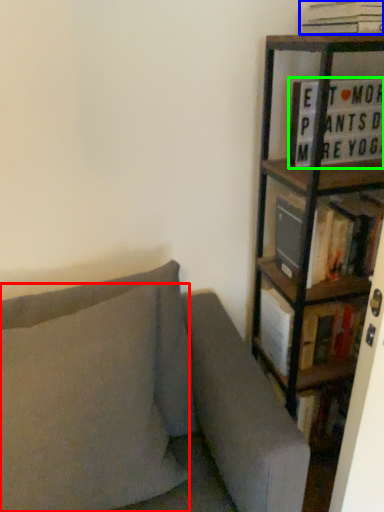
Question: Which is nearer to the pillow (highlighted by a red box)? book (highlighted by a blue box) or book (highlighted by a green box).

Choices:
 (A) book
 (B) book

Answer: (B)